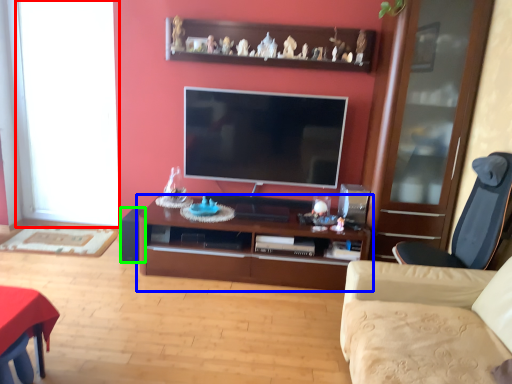
Question: Which is farther away from window (highlighted by a red box)? cabinetry (highlighted by a blue box) or speaker (highlighted by a green box)?

Choices:
 (A) cabinetry
 (B) speaker

Answer: (A)